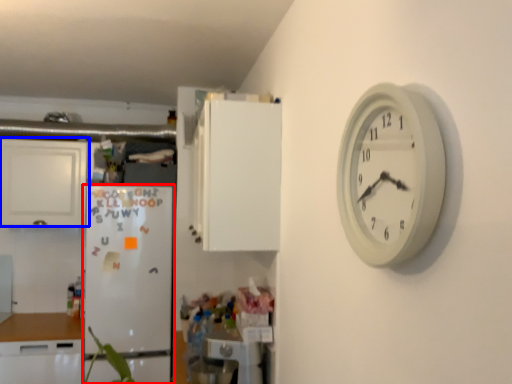
Question: Among these objects, which one is nearest to the camera, fridge (highlighted by a red box) or cabinetry (highlighted by a blue box)?

Choices:
 (A) fridge
 (B) cabinetry

Answer: (A)